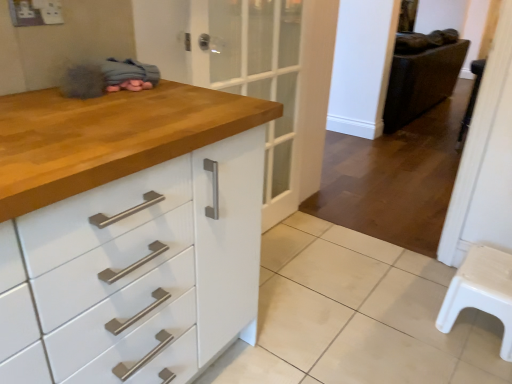
The height and width of the screenshot is (384, 512). Identify the location of empty space that is ontop of white plastic stool at lower right (from a real-world perspective). (488, 272).